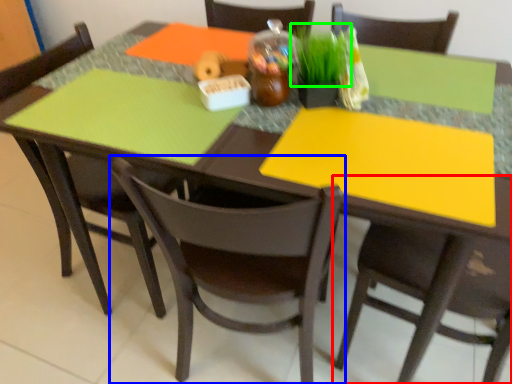
Question: Which object is positioned closest to chair (highlighted by a red box)? Select from chair (highlighted by a blue box) and grass (highlighted by a green box).

Choices:
 (A) chair
 (B) grass

Answer: (A)